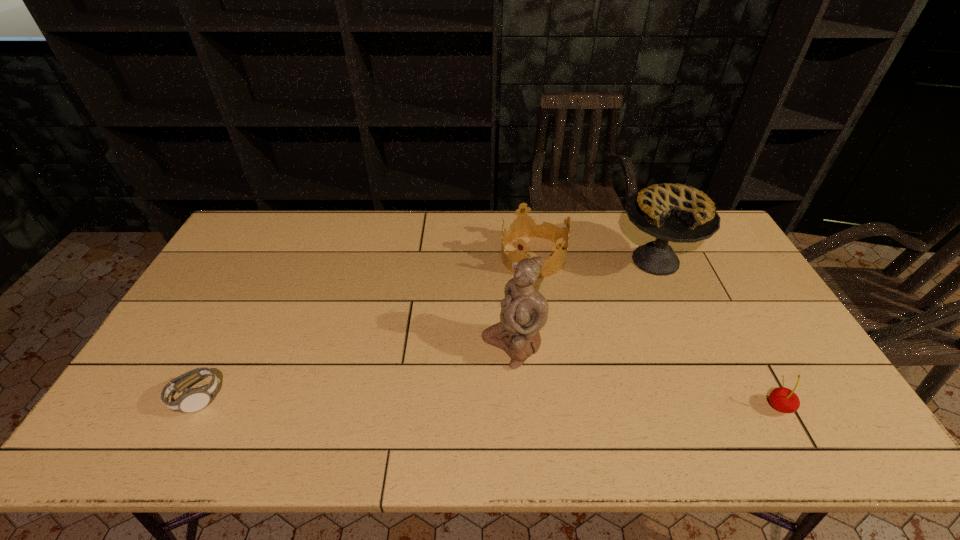
You are a GUI agent. You are given a task and a screenshot of the screen. Output one action in this format:
    pyautogui.click(x=<x>, y=<y>)
    Task: Click on the cherry at the near edge
    
    Given the screenshot: What is the action you would take?
    pyautogui.click(x=783, y=399)

Identify the location of object at the left edge. The height and width of the screenshot is (540, 960). (192, 400).

Find the location of a particular element. The image size is (960, 540). cherry located in the right edge section of the desktop is located at coordinates (783, 399).

Where is `pie located in the right edge section of the desktop`? This screenshot has width=960, height=540. pie located in the right edge section of the desktop is located at coordinates (678, 213).

Identify the location of object that is at the near left corner. The height and width of the screenshot is (540, 960). (x=192, y=400).

This screenshot has width=960, height=540. Find the location of `object that is at the far right corner`. object that is at the far right corner is located at coordinates (678, 213).

Identify the location of object present at the near right corner. point(783,399).

This screenshot has height=540, width=960. I want to click on blank area at the far edge, so click(627, 245).

In the image, there is a desktop. At what (x,y) coordinates should I click in order to perform the action: click on vacant space at the near edge. Please return your answer as a coordinate pair (x, y). Looking at the image, I should click on (487, 388).

In the image, there is a desktop. At what (x,y) coordinates should I click in order to perform the action: click on blank space at the left edge. Please return your answer as a coordinate pair (x, y). Image resolution: width=960 pixels, height=540 pixels. Looking at the image, I should click on (204, 308).